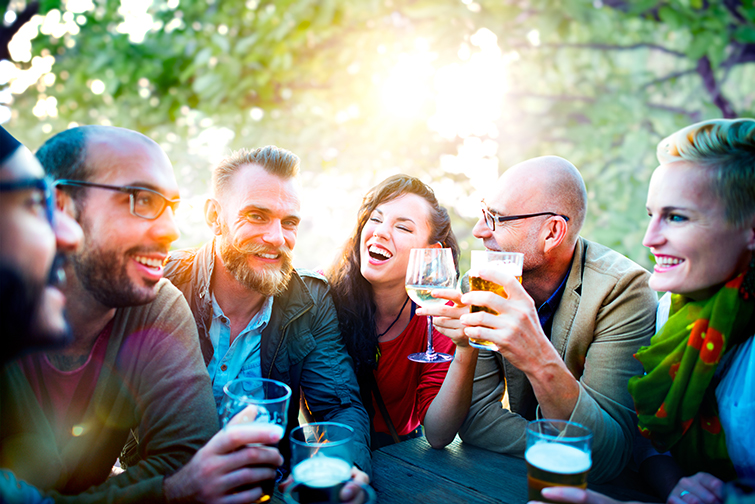
At what (x,y) coordinates should I click in order to perform the action: click on drinking glass. Please return your answer as a coordinate pair (x, y). The width and height of the screenshot is (755, 504). Looking at the image, I should click on (559, 451), (510, 260), (426, 262), (324, 456), (275, 397).